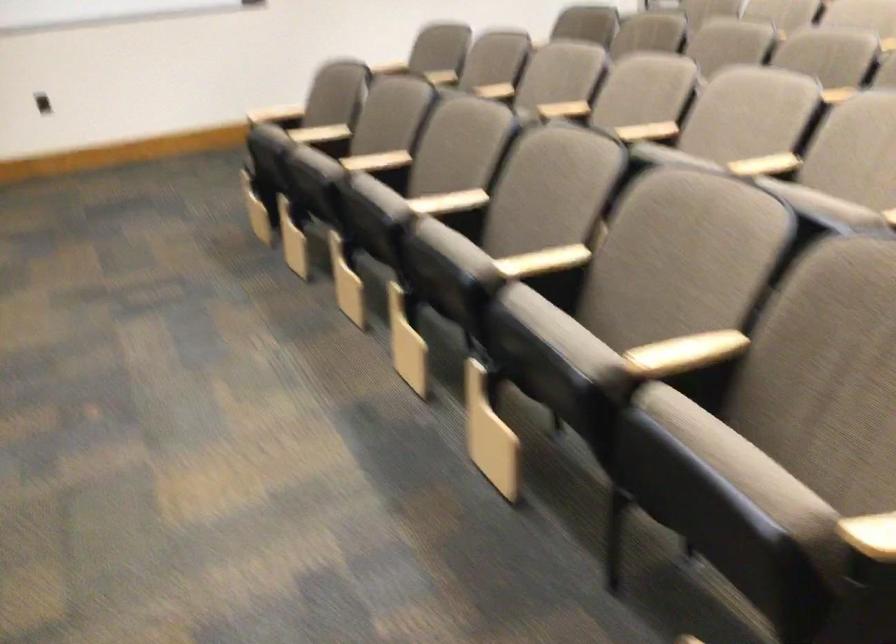
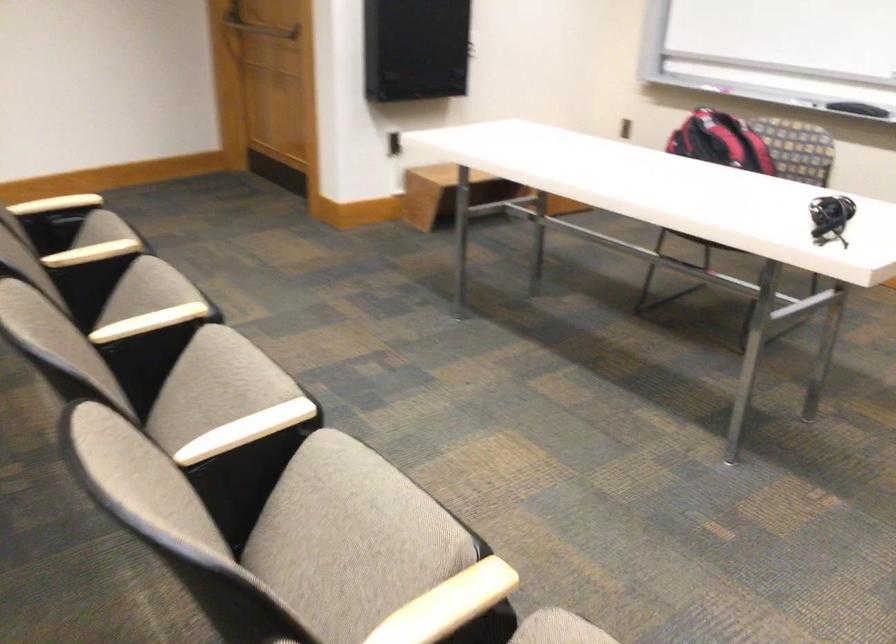
In the second image, find the point that corresponds to point (561, 316) in the first image.

(147, 290)